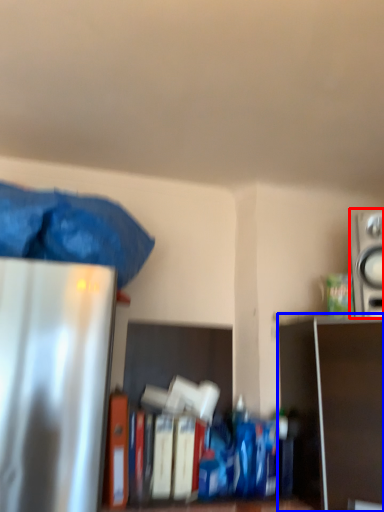
Question: Which object appears farthest to the camera in this image, appliance (highlighted by a red box) or shelf (highlighted by a blue box)?

Choices:
 (A) appliance
 (B) shelf

Answer: (A)